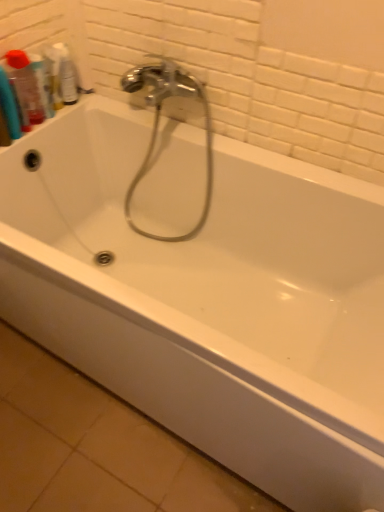
Question: Does point (33, 60) appear closer or farther from the camera than point (190, 88)?

Choices:
 (A) closer
 (B) farther

Answer: (B)

Question: From the image's perspective, is translucent plastic mouthwash at upper left, arranged as the 2th mouthwash when viewed from the left, above or below chrome metallic faucet at center?

Choices:
 (A) below
 (B) above

Answer: (B)

Question: Estimate the real-world distances between objects in this image. Which object is closer to the translucent plastic mouthwash at upper left, the 3th mouthwash in the right-to-left sequence?

Choices:
 (A) chrome metallic faucet at center
 (B) translucent plastic mouthwash at upper left, arranged as the 2th mouthwash when viewed from the left
 (C) clear plastic bottle at upper left, which is counted as the 3th mouthwash, starting from the left

Answer: (B)

Question: Estimate the real-world distances between objects in this image. Which object is farther from the chrome metallic faucet at center?

Choices:
 (A) clear plastic bottle at upper left, which is counted as the 3th mouthwash, starting from the left
 (B) translucent plastic mouthwash at upper left, arranged as the second mouthwash when viewed from the right
 (C) translucent plastic mouthwash at upper left, the 3th mouthwash in the right-to-left sequence

Answer: (C)